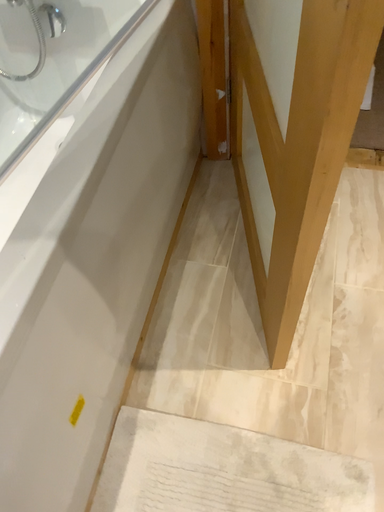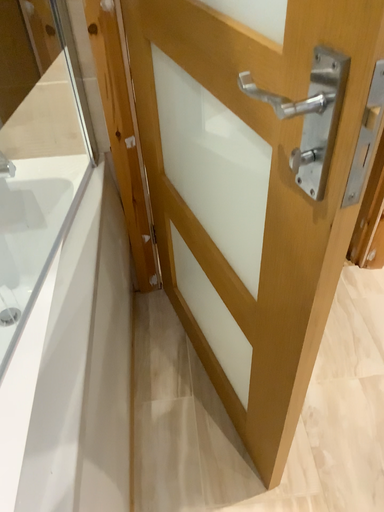
Question: How did the camera likely rotate when shooting the video?

Choices:
 (A) rotated downward
 (B) rotated upward

Answer: (B)